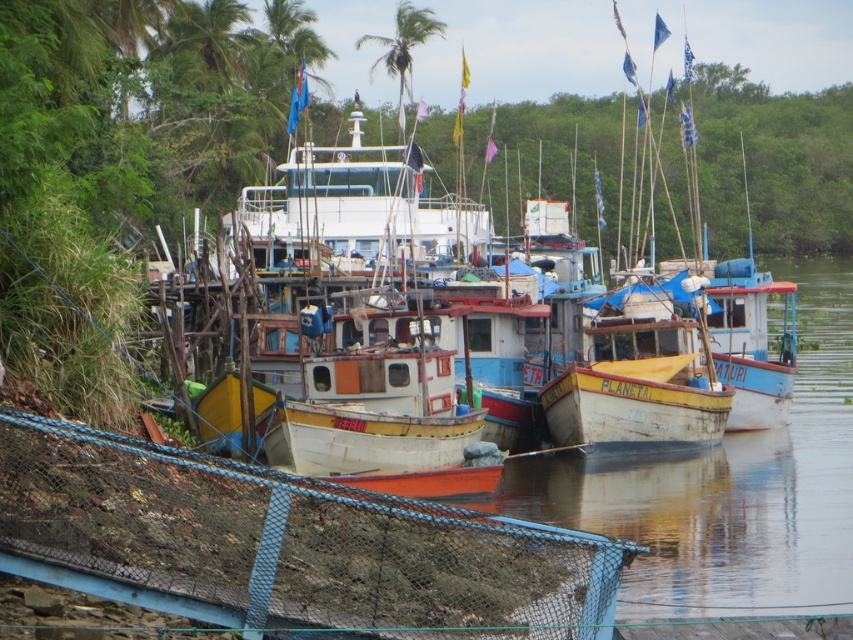
You are standing on the riverbank and notice the blue mesh net at lower left and the green leafy palm tree at upper center. Which object is positioned more to the left side of the scene?

The green leafy palm tree at upper center is positioned more to the left side of the scene because the blue mesh net at lower left is to the right of it.